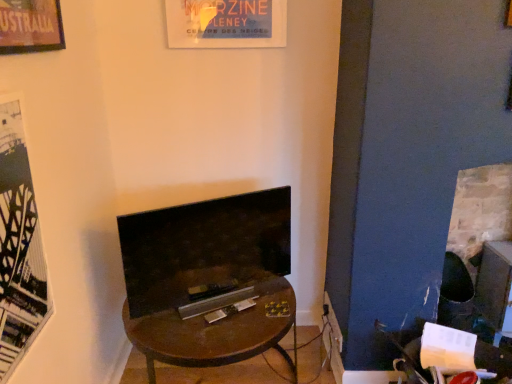
In order to face matte black tv at center, which is counted as the first fireplace, starting from the left, should I rotate leftwards or rightwards?

Rotate left and turn 5.640 degrees.

Describe the element at coordinates (229, 310) in the screenshot. This screenshot has height=384, width=512. I see `metallic silver magazine at center` at that location.

The width and height of the screenshot is (512, 384). What do you see at coordinates (216, 333) in the screenshot? I see `brown wooden desk at center` at bounding box center [216, 333].

Where is `matte black tv at center, which ranks as the 2th fireplace in right-to-left order`? This screenshot has width=512, height=384. matte black tv at center, which ranks as the 2th fireplace in right-to-left order is located at coordinates (x=205, y=252).

Can you see black matte poster at left touching brown wooden desk at center?

No, black matte poster at left is not with brown wooden desk at center.

Which is closer, (x=8, y=310) or (x=227, y=349)?

Point (x=8, y=310) appears to be closer to the viewer than point (x=227, y=349).

Where is `movie poster located in front of the brown wooden desk at center`? This screenshot has height=384, width=512. movie poster located in front of the brown wooden desk at center is located at coordinates (19, 247).

Considering the sizes of black matte poster at left and brown wooden desk at center in the image, is black matte poster at left bigger or smaller than brown wooden desk at center?

black matte poster at left is smaller than brown wooden desk at center.

From a real-world perspective, who is located higher, matte black tv at center, which ranks as the 2th fireplace in right-to-left order, or brick fireplace at right, acting as the second fireplace starting from the left?

A: matte black tv at center, which ranks as the 2th fireplace in right-to-left order, from a real-world perspective.

Can you confirm if matte black tv at center, which ranks as the 2th fireplace in right-to-left order, is positioned to the left of brick fireplace at right, positioned as the first fireplace in right-to-left order?

Yes.

Who is shorter, matte black tv at center, which is counted as the first fireplace, starting from the left, or brick fireplace at right, acting as the second fireplace starting from the left?

Standing shorter between the two is matte black tv at center, which is counted as the first fireplace, starting from the left.

In the image, is metallic silver magazine at center positioned in front of or behind black matte poster at left?

metallic silver magazine at center is behind black matte poster at left.

From the image's perspective, which is below, metallic silver magazine at center or black matte poster at left?

metallic silver magazine at center is shown below in the image.

How far apart are metallic silver magazine at center and black matte poster at left?

The distance of metallic silver magazine at center from black matte poster at left is 31.25 inches.

Considering the points (207, 321) and (33, 195), which point is behind, point (207, 321) or point (33, 195)?

The point (207, 321) is farther from the camera.

Is matte black tv at center, which ranks as the 2th fireplace in right-to-left order, wider or thinner than metallic silver magazine at center?

Clearly, matte black tv at center, which ranks as the 2th fireplace in right-to-left order, has more width compared to metallic silver magazine at center.

In the image, is matte black tv at center, which ranks as the 2th fireplace in right-to-left order, positioned in front of or behind metallic silver magazine at center?

Visually, matte black tv at center, which ranks as the 2th fireplace in right-to-left order, is located in front of metallic silver magazine at center.

Is matte black tv at center, which is counted as the first fireplace, starting from the left, oriented towards metallic silver magazine at center?

Yes, matte black tv at center, which is counted as the first fireplace, starting from the left, is turned towards metallic silver magazine at center.

Measure the distance from matte black tv at center, which is counted as the first fireplace, starting from the left, to metallic silver magazine at center.

A distance of 9.82 inches exists between matte black tv at center, which is counted as the first fireplace, starting from the left, and metallic silver magazine at center.

Is brown wooden desk at center at the left side of matte black tv at center, which ranks as the 2th fireplace in right-to-left order?

In fact, brown wooden desk at center is to the right of matte black tv at center, which ranks as the 2th fireplace in right-to-left order.

Which of these two, brown wooden desk at center or matte black tv at center, which is counted as the first fireplace, starting from the left, stands taller?

Standing taller between the two is matte black tv at center, which is counted as the first fireplace, starting from the left.

Looking at this image, from a real-world perspective, does brown wooden desk at center stand above matte black tv at center, which ranks as the 2th fireplace in right-to-left order?

Actually, brown wooden desk at center is physically below matte black tv at center, which ranks as the 2th fireplace in right-to-left order, in the real world.

Would you say matte black tv at center, which ranks as the 2th fireplace in right-to-left order, is part of brown wooden desk at center's contents?

That's incorrect, matte black tv at center, which ranks as the 2th fireplace in right-to-left order, is not inside brown wooden desk at center.

Is brick fireplace at right, acting as the second fireplace starting from the left, wider than brown wooden desk at center?

In fact, brick fireplace at right, acting as the second fireplace starting from the left, might be narrower than brown wooden desk at center.

From the picture: Which of these two, brick fireplace at right, acting as the second fireplace starting from the left, or brown wooden desk at center, is bigger?

brown wooden desk at center is bigger.

From a real-world perspective, relative to brown wooden desk at center, is brick fireplace at right, acting as the second fireplace starting from the left, vertically above or below?

In terms of real-world spatial position, brick fireplace at right, acting as the second fireplace starting from the left, is above brown wooden desk at center.

Between brown wooden desk at center and metallic silver magazine at center, which one appears on the right side from the viewer's perspective?

metallic silver magazine at center is more to the right.

Does brown wooden desk at center have a greater width compared to metallic silver magazine at center?

Correct, the width of brown wooden desk at center exceeds that of metallic silver magazine at center.

From the image's perspective, between brown wooden desk at center and metallic silver magazine at center, who is located below?

brown wooden desk at center appears lower in the image.

This screenshot has height=384, width=512. I want to click on movie poster above the brown wooden desk at center (from a real-world perspective), so click(x=19, y=247).

The height and width of the screenshot is (384, 512). I want to click on fireplace on the right of matte black tv at center, which is counted as the first fireplace, starting from the left, so click(473, 238).

When comparing their distances from brick fireplace at right, positioned as the first fireplace in right-to-left order, does matte black tv at center, which ranks as the 2th fireplace in right-to-left order, or brown wooden desk at center seem closer?

brown wooden desk at center.

Estimate the real-world distances between objects in this image. Which object is closer to black matte poster at left, brick fireplace at right, acting as the second fireplace starting from the left, or brown wooden desk at center?

brown wooden desk at center is closer to black matte poster at left.

Which object lies nearer to the anchor point brown wooden desk at center, black matte poster at left or metallic silver magazine at center?

metallic silver magazine at center is positioned closer to the anchor brown wooden desk at center.

Estimate the real-world distances between objects in this image. Which object is closer to brick fireplace at right, positioned as the first fireplace in right-to-left order, brown wooden desk at center or matte black tv at center, which ranks as the 2th fireplace in right-to-left order?

The object closer to brick fireplace at right, positioned as the first fireplace in right-to-left order, is brown wooden desk at center.

Estimate the real-world distances between objects in this image. Which object is closer to brown wooden desk at center, metallic silver magazine at center or matte black tv at center, which is counted as the first fireplace, starting from the left?

metallic silver magazine at center is closer to brown wooden desk at center.

From the image, which object appears to be farther from metallic silver magazine at center, brown wooden desk at center or matte black tv at center, which is counted as the first fireplace, starting from the left?

matte black tv at center, which is counted as the first fireplace, starting from the left, is further to metallic silver magazine at center.

Looking at the image, which one is located closer to brown wooden desk at center, brick fireplace at right, positioned as the first fireplace in right-to-left order, or matte black tv at center, which ranks as the 2th fireplace in right-to-left order?

matte black tv at center, which ranks as the 2th fireplace in right-to-left order.

Looking at the image, which one is located closer to matte black tv at center, which is counted as the first fireplace, starting from the left, brick fireplace at right, acting as the second fireplace starting from the left, or black matte poster at left?

Among the two, black matte poster at left is located nearer to matte black tv at center, which is counted as the first fireplace, starting from the left.

I want to click on desk positioned between black matte poster at left and matte black tv at center, which is counted as the first fireplace, starting from the left, from near to far, so click(x=216, y=333).

The image size is (512, 384). I want to click on fireplace between black matte poster at left and metallic silver magazine at center from front to back, so click(205, 252).

The width and height of the screenshot is (512, 384). In order to click on magazine between matte black tv at center, which is counted as the first fireplace, starting from the left, and brick fireplace at right, positioned as the first fireplace in right-to-left order, from left to right in this screenshot , I will do `click(229, 310)`.

Identify the location of magazine located between brown wooden desk at center and brick fireplace at right, acting as the second fireplace starting from the left, in the left-right direction. (229, 310).